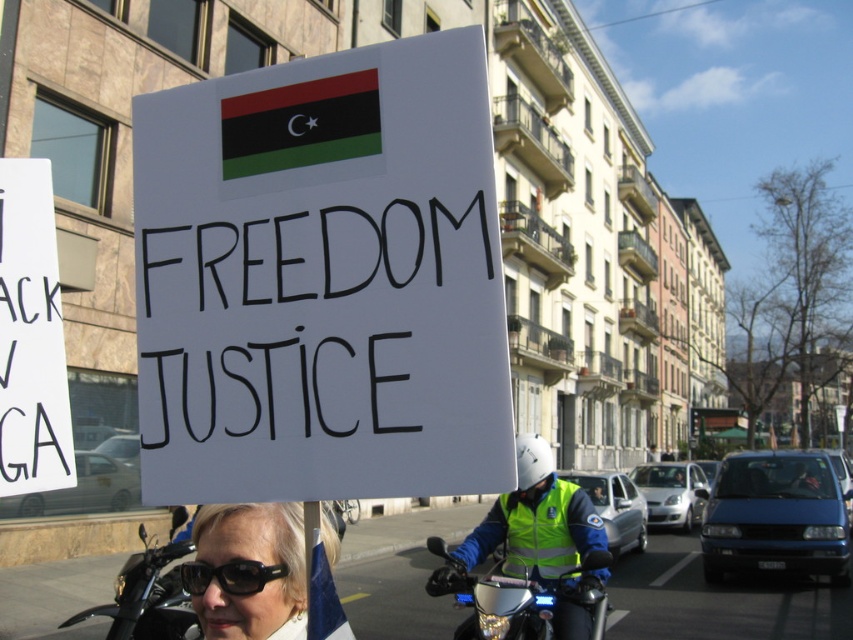
Can you confirm if high-visibility reflective vest at center is wider than metallic silver motorcycle at center?

No, high-visibility reflective vest at center is not wider than metallic silver motorcycle at center.

Between high-visibility reflective vest at center and metallic silver motorcycle at center, which one is positioned higher?

Positioned higher is high-visibility reflective vest at center.

Image resolution: width=853 pixels, height=640 pixels. Identify the location of high-visibility reflective vest at center. (531, 560).

Does white paper sign at center have a greater width compared to high-visibility reflective vest at center?

Indeed, white paper sign at center has a greater width compared to high-visibility reflective vest at center.

Based on the photo, who is higher up, white paper sign at center or high-visibility reflective vest at center?

white paper sign at center is higher up.

Who is more distant from viewer, [393,432] or [430,540]?

Positioned behind is point [430,540].

At what (x,y) coordinates should I click in order to perform the action: click on white paper sign at center. Please return your answer as a coordinate pair (x, y). This screenshot has height=640, width=853. Looking at the image, I should click on (322, 280).

Which is more to the right, white paper sign at center or black glossy motorcycle at lower left?

white paper sign at center is more to the right.

This screenshot has height=640, width=853. What do you see at coordinates (322, 280) in the screenshot?
I see `white paper sign at center` at bounding box center [322, 280].

The image size is (853, 640). What are the coordinates of `white paper sign at center` in the screenshot? It's located at (322, 280).

Where is `white paper sign at center`? This screenshot has width=853, height=640. white paper sign at center is located at coordinates (322, 280).